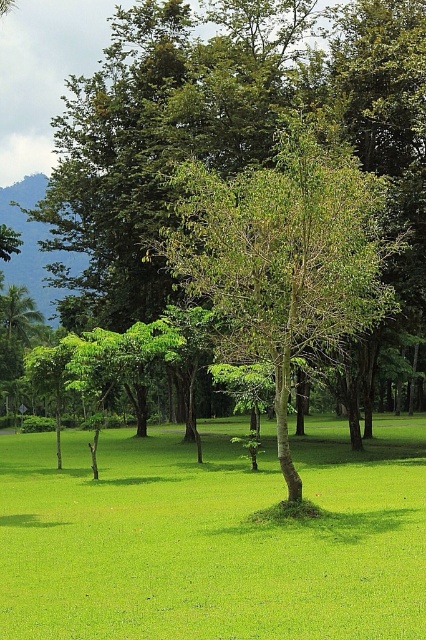
You are standing in the park and see the green grass at center and the green leafy tree at center. Which object is positioned more to the left side of the park?

The green grass at center is positioned more to the left side of the park than the green leafy tree at center.